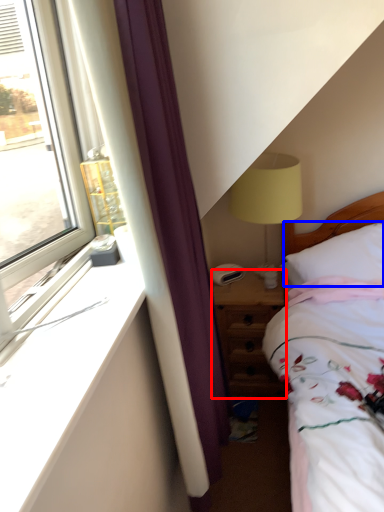
Question: Which of the following is the farthest to the observer, nightstand (highlighted by a red box) or pillow (highlighted by a blue box)?

Choices:
 (A) nightstand
 (B) pillow

Answer: (A)